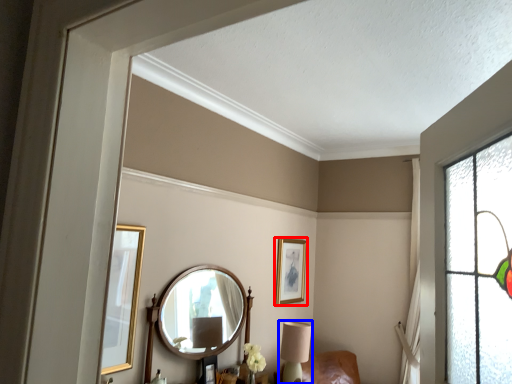
Question: Which object appears closest to the camera in this image, picture frame (highlighted by a red box) or table lamp (highlighted by a blue box)?

Choices:
 (A) picture frame
 (B) table lamp

Answer: (B)